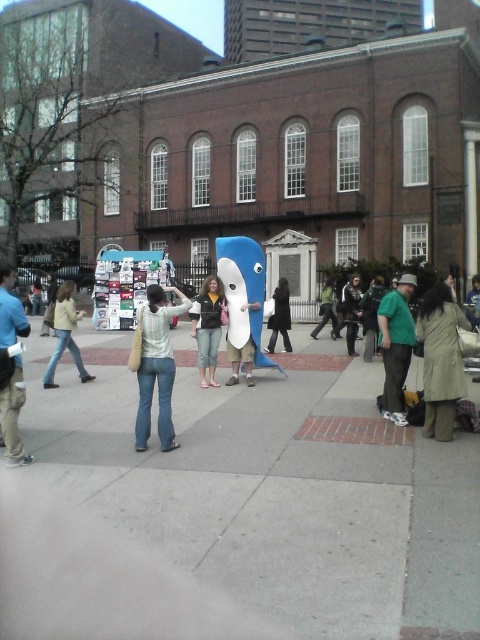
You are a photographer trying to capture both the green matte shirt at center and the white matte shark at center in a single shot. Since you want to highlight both equally, which object should you move closer to the camera to ensure they appear the same size in the photo?

You should move the green matte shirt at center closer to the camera because it is smaller in size compared to the white matte shark at center. By bringing it nearer, the shirt will appear larger in the photo, balancing their sizes.

You are a photographer trying to capture the green matte shirt at center and the white matte shark at center in a single frame. Which object should you focus on first to ensure both are in the frame without zooming in or out?

You should focus on the white matte shark at center first because it is wider than the green matte shirt at center, so positioning the camera to accommodate its width will ensure both objects fit without needing to zoom.

You are a photographer standing in the city square and see the person wearing the green fabric jacket at center and the dark green shirt at center. Which clothing item is closer to the ground?

The green fabric jacket at center is located below dark green shirt at center, so the green fabric jacket at center is closer to the ground.